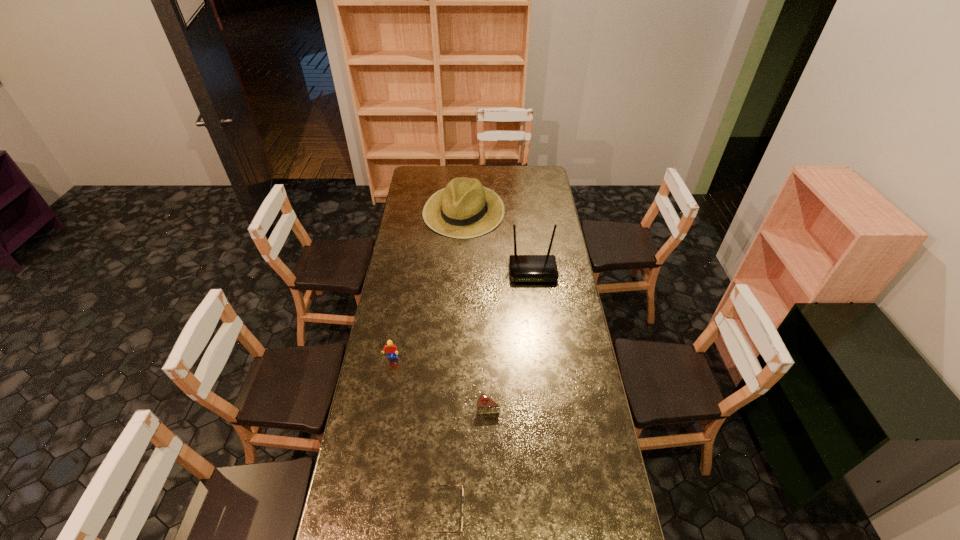
Locate an element on the screen. The width and height of the screenshot is (960, 540). the closest object relative to the Lego is located at coordinates (485, 405).

Point out which object is positioned as the third nearest to the shortest object. Please provide its 2D coordinates. Your answer should be formatted as a tuple, i.e. [(x, y)], where the tuple contains the x and y coordinates of a point satisfying the conditions above.

[(523, 268)]

Locate an element on the screen. vacant space that satisfies the following two spatial constraints: 1. on the front-facing side of the rightmost object; 2. on the frame of the nearest object is located at coordinates (564, 512).

This screenshot has height=540, width=960. I want to click on vacant space that satisfies the following two spatial constraints: 1. on the front-facing side of the tallest object; 2. on the frame of the nearest object, so click(x=564, y=512).

Locate an element on the screen. This screenshot has height=540, width=960. blank area in the image that satisfies the following two spatial constraints: 1. on the front side of the second shortest object; 2. on the frame of the spectacles is located at coordinates (490, 512).

The width and height of the screenshot is (960, 540). I want to click on free region that satisfies the following two spatial constraints: 1. on the front side of the fourth shortest object; 2. on the frame of the shortest object, so click(x=450, y=512).